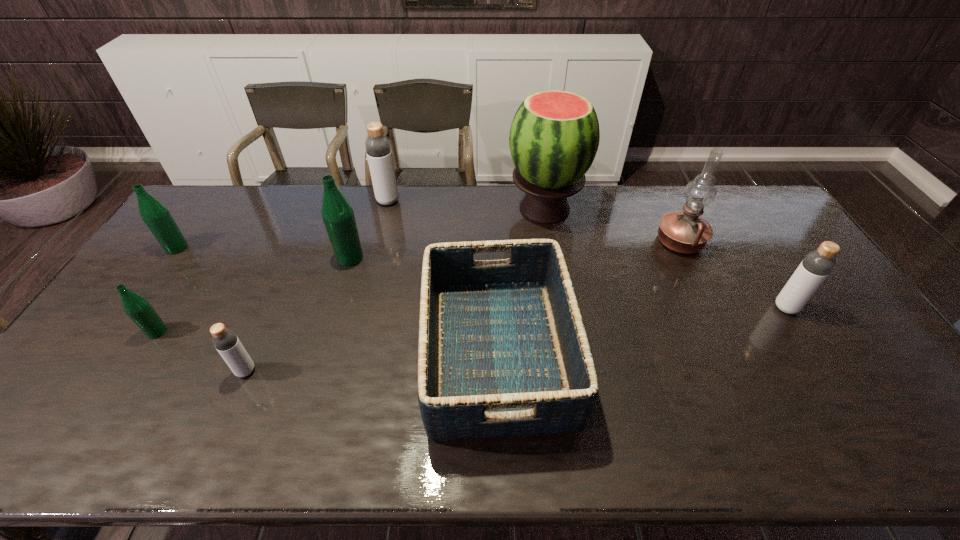
This screenshot has height=540, width=960. I want to click on blank area located on the back of the basket, so click(x=493, y=240).

The image size is (960, 540). I want to click on free space located 0.070m on the left of the fifth bottle from right to left, so click(122, 332).

This screenshot has width=960, height=540. In order to click on free spot located 0.370m on the back of the nearest bottle in this screenshot , I will do `click(292, 263)`.

Locate an element on the screen. Image resolution: width=960 pixels, height=540 pixels. watermelon that is at the far edge is located at coordinates (554, 137).

Where is `bottle that is at the far edge`? Image resolution: width=960 pixels, height=540 pixels. bottle that is at the far edge is located at coordinates (378, 148).

In order to click on object situated at the near edge in this screenshot , I will do coord(503,352).

Image resolution: width=960 pixels, height=540 pixels. In order to click on object that is at the right edge in this screenshot , I will do `click(816, 266)`.

This screenshot has width=960, height=540. Identify the location of free spot at the far edge of the desktop. (571, 212).

In order to click on vacant space at the near edge of the desktop in this screenshot , I will do `click(355, 455)`.

Where is `free space at the right edge of the desktop`? The image size is (960, 540). free space at the right edge of the desktop is located at coordinates (776, 234).